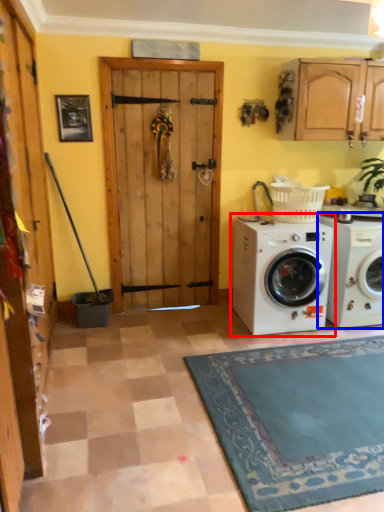
Question: Which object appears farthest to the camera in this image, washing machine (highlighted by a red box) or washing machine (highlighted by a blue box)?

Choices:
 (A) washing machine
 (B) washing machine

Answer: (B)